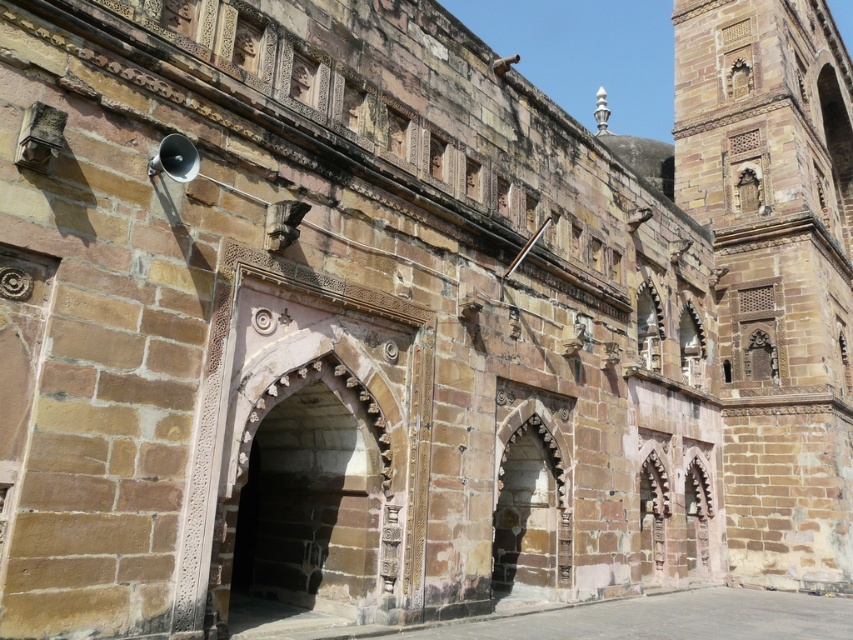
Question: Which object appears farthest from the camera in this image?

Choices:
 (A) brown stone tower at right
 (B) stone textured archway at center

Answer: (A)

Question: Which object appears farthest from the camera in this image?

Choices:
 (A) brown stone tower at right
 (B) stone textured archway at center

Answer: (A)

Question: Is brown stone tower at right above stone textured archway at center?

Choices:
 (A) no
 (B) yes

Answer: (B)

Question: Can you confirm if brown stone tower at right is thinner than stone textured archway at center?

Choices:
 (A) yes
 (B) no

Answer: (B)

Question: Does brown stone tower at right have a lesser width compared to stone textured archway at center?

Choices:
 (A) no
 (B) yes

Answer: (A)

Question: Which object appears farthest from the camera in this image?

Choices:
 (A) stone textured archway at center
 (B) brown stone tower at right

Answer: (B)